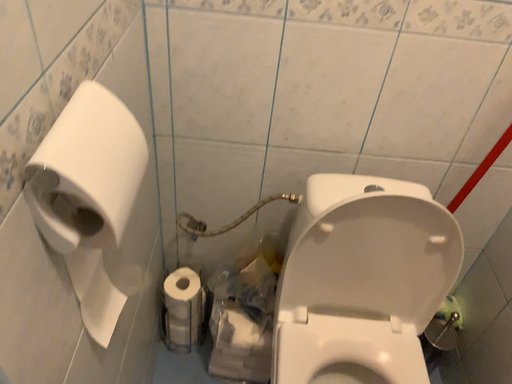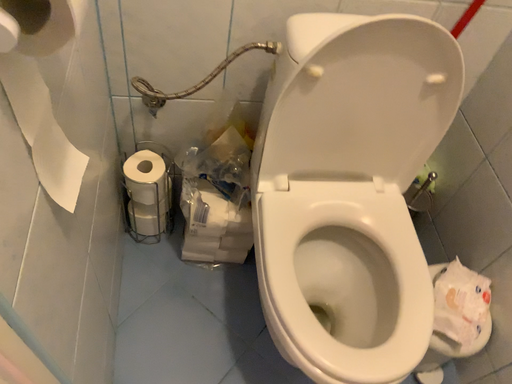
Question: Which way did the camera rotate in the video?

Choices:
 (A) rotated downward
 (B) rotated upward

Answer: (A)